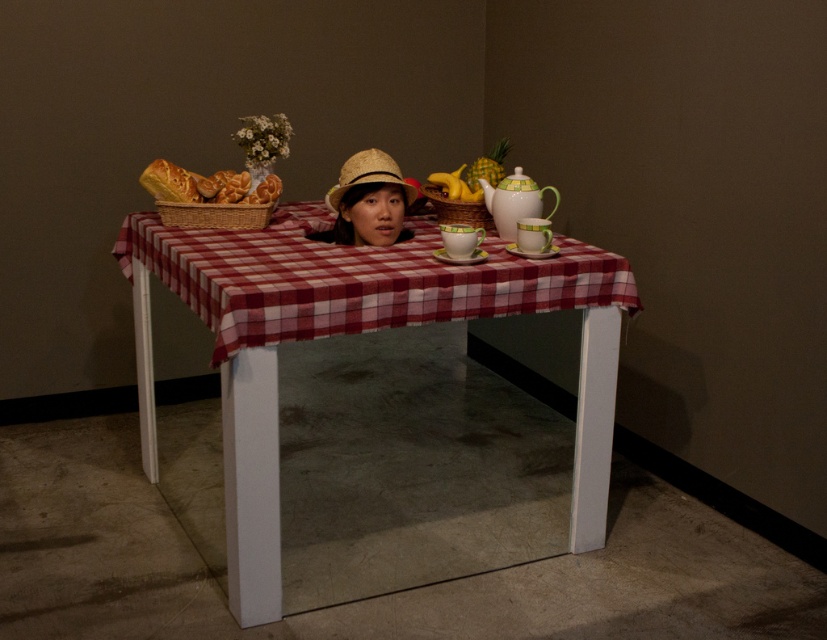
Does red checkered tablecloth at center have a larger size compared to straw hat at center?

Correct, red checkered tablecloth at center is larger in size than straw hat at center.

Looking at this image, how far apart are red checkered tablecloth at center and straw hat at center?

They are 14.30 inches apart.

Is point (605, 294) less distant than point (359, 152)?

Yes, it is in front of point (359, 152).

Where is `red checkered tablecloth at center`? Image resolution: width=827 pixels, height=640 pixels. red checkered tablecloth at center is located at coordinates (354, 278).

Is golden brown bread at left positioned behind straw hat at center?

Yes, golden brown bread at left is behind straw hat at center.

Can you confirm if golden brown bread at left is thinner than straw hat at center?

No, golden brown bread at left is not thinner than straw hat at center.

The width and height of the screenshot is (827, 640). Identify the location of golden brown bread at left. (206, 186).

This screenshot has height=640, width=827. I want to click on white glossy table at center, so click(352, 330).

Locate an element on the screen. The width and height of the screenshot is (827, 640). white glossy table at center is located at coordinates (352, 330).